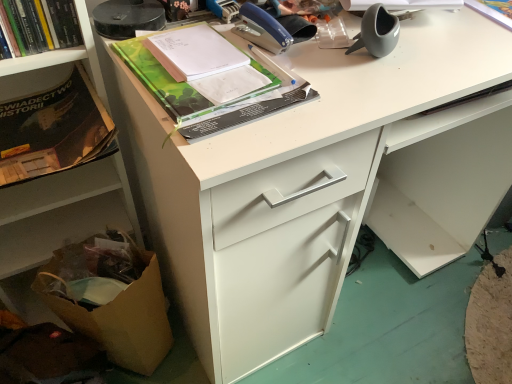
I want to click on free location to the right of blue plastic stapler at upper center, arranged as the second office supplies when viewed from the right, so click(358, 61).